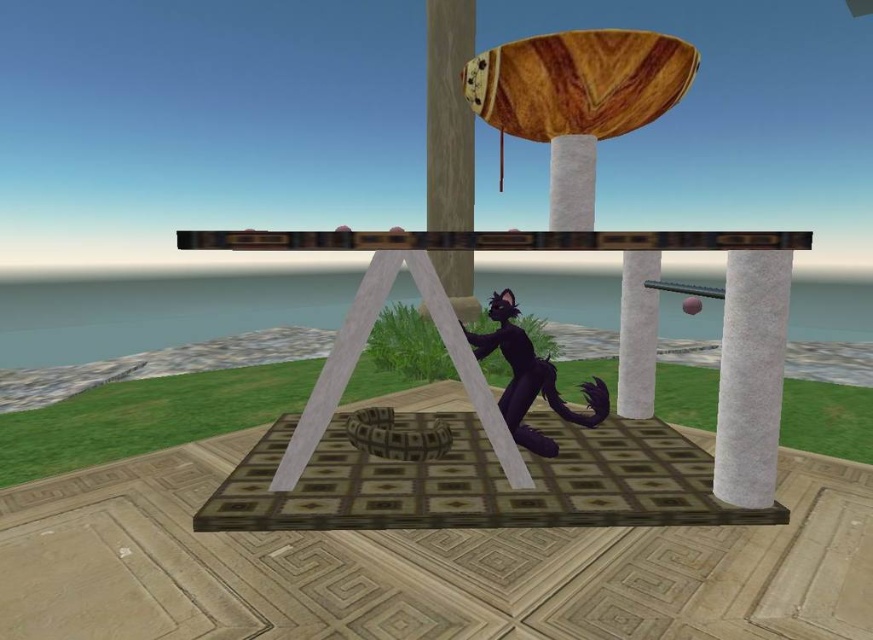
Between shiny black cat at center and wooden pole at center, which one has less height?

wooden pole at center

Which of these two, shiny black cat at center or wooden pole at center, stands taller?

With more height is shiny black cat at center.

Locate an element on the screen. Image resolution: width=873 pixels, height=640 pixels. shiny black cat at center is located at coordinates (534, 420).

Based on the photo, does shiny black cat at center have a lesser height compared to white felt pillar at right?

No.

Is shiny black cat at center bigger than white felt pillar at right?

Yes, shiny black cat at center is bigger than white felt pillar at right.

Locate an element on the screen. The width and height of the screenshot is (873, 640). shiny black cat at center is located at coordinates (534, 420).

Does point (452, 61) lie behind point (576, 172)?

That is True.

Between wooden pole at center and white marble pillar at center, which one appears on the right side from the viewer's perspective?

From the viewer's perspective, white marble pillar at center appears more on the right side.

Which is behind, point (430, 84) or point (574, 179)?

Point (430, 84)

Locate an element on the screen. The width and height of the screenshot is (873, 640). wooden pole at center is located at coordinates (448, 115).